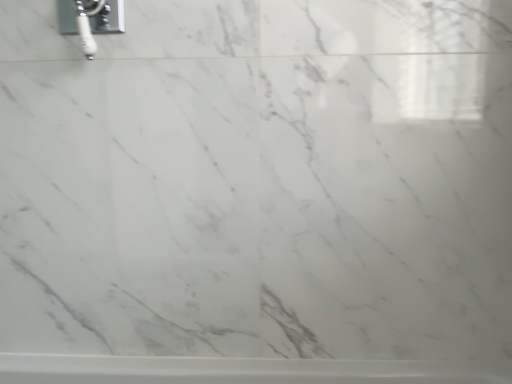
Image resolution: width=512 pixels, height=384 pixels. What do you see at coordinates (239, 370) in the screenshot?
I see `white glossy bathtub at lower center` at bounding box center [239, 370].

At what (x,y) coordinates should I click in order to perform the action: click on white glossy bathtub at lower center. Please return your answer as a coordinate pair (x, y). Looking at the image, I should click on pos(239,370).

Measure the distance between point [115,3] and camera.

Point [115,3] is 30.63 inches from camera.

In the scene shown: Measure the distance between chrome metallic faucet at upper left and camera.

The depth of chrome metallic faucet at upper left is 28.73 inches.

In order to face chrome metallic faucet at upper left, should I rotate leftwards or rightwards?

To align with it, rotate left about 23.198°.

Describe the element at coordinates (90, 20) in the screenshot. I see `chrome metallic faucet at upper left` at that location.

The image size is (512, 384). What are the coordinates of `chrome metallic faucet at upper left` in the screenshot? It's located at (90, 20).

This screenshot has width=512, height=384. I want to click on white glossy bathtub at lower center, so click(239, 370).

Which object is positioned more to the right, chrome metallic faucet at upper left or white glossy bathtub at lower center?

white glossy bathtub at lower center.

Between chrome metallic faucet at upper left and white glossy bathtub at lower center, which one is positioned in front?

chrome metallic faucet at upper left.

Is point (100, 6) positioned before point (161, 371)?

Yes, it is.

From the image's perspective, between chrome metallic faucet at upper left and white glossy bathtub at lower center, who is located below?

From the image's view, white glossy bathtub at lower center is below.

From a real-world perspective, which object stands above the other?

From a 3D spatial view, chrome metallic faucet at upper left is above.

Can you confirm if chrome metallic faucet at upper left is wider than white glossy bathtub at lower center?

No, chrome metallic faucet at upper left is not wider than white glossy bathtub at lower center.

Based on the photo, which of these two, chrome metallic faucet at upper left or white glossy bathtub at lower center, stands taller?

chrome metallic faucet at upper left is taller.

Is chrome metallic faucet at upper left smaller than white glossy bathtub at lower center?

Correct, chrome metallic faucet at upper left occupies less space than white glossy bathtub at lower center.

Is white glossy bathtub at lower center completely or partially inside chrome metallic faucet at upper left?

Definitely not — white glossy bathtub at lower center is not inside chrome metallic faucet at upper left.

From the picture: Is chrome metallic faucet at upper left far away from white glossy bathtub at lower center?

They are positioned close to each other.

Is chrome metallic faucet at upper left oriented towards white glossy bathtub at lower center?

No, chrome metallic faucet at upper left is not oriented towards white glossy bathtub at lower center.

Can you tell me how much chrome metallic faucet at upper left and white glossy bathtub at lower center differ in facing direction?

The angular difference between chrome metallic faucet at upper left and white glossy bathtub at lower center is 0.905 degrees.

Locate an element on the screen. The width and height of the screenshot is (512, 384). bathtub behind the chrome metallic faucet at upper left is located at coordinates (239, 370).

Considering the relative positions of white glossy bathtub at lower center and chrome metallic faucet at upper left in the image provided, is white glossy bathtub at lower center to the left or to the right of chrome metallic faucet at upper left?

white glossy bathtub at lower center is to the right of chrome metallic faucet at upper left.

Which object is more forward, white glossy bathtub at lower center or chrome metallic faucet at upper left?

chrome metallic faucet at upper left is in front.

Which is farther from the camera, (x=354, y=367) or (x=81, y=13)?

The point (x=354, y=367) is behind.

From the image's perspective, is white glossy bathtub at lower center beneath chrome metallic faucet at upper left?

Yes.

From a real-world perspective, between white glossy bathtub at lower center and chrome metallic faucet at upper left, who is vertically higher?

chrome metallic faucet at upper left.

Considering the sizes of objects white glossy bathtub at lower center and chrome metallic faucet at upper left in the image provided, who is wider, white glossy bathtub at lower center or chrome metallic faucet at upper left?

With larger width is white glossy bathtub at lower center.

Between white glossy bathtub at lower center and chrome metallic faucet at upper left, which one has more height?

With more height is chrome metallic faucet at upper left.

Is white glossy bathtub at lower center smaller than chrome metallic faucet at upper left?

Incorrect, white glossy bathtub at lower center is not smaller in size than chrome metallic faucet at upper left.

Is white glossy bathtub at lower center situated inside chrome metallic faucet at upper left or outside?

white glossy bathtub at lower center is located beyond the bounds of chrome metallic faucet at upper left.

Is white glossy bathtub at lower center next to chrome metallic faucet at upper left and touching it?

They are not placed beside each other.

Is white glossy bathtub at lower center turned away from chrome metallic faucet at upper left?

white glossy bathtub at lower center is not turned away from chrome metallic faucet at upper left.

How many degrees apart are the facing directions of white glossy bathtub at lower center and chrome metallic faucet at upper left?

white glossy bathtub at lower center and chrome metallic faucet at upper left are facing 0.905 degrees away from each other.

How distant is white glossy bathtub at lower center from chrome metallic faucet at upper left?

27.39 inches.

Image resolution: width=512 pixels, height=384 pixels. I want to click on plumbing fixture in front of the white glossy bathtub at lower center, so click(x=90, y=20).

Find the location of `bathtub located below the chrome metallic faucet at upper left (from the image's perspective)`. bathtub located below the chrome metallic faucet at upper left (from the image's perspective) is located at coordinates (239, 370).

The width and height of the screenshot is (512, 384). What are the coordinates of `plumbing fixture on the left of white glossy bathtub at lower center` in the screenshot? It's located at (90, 20).